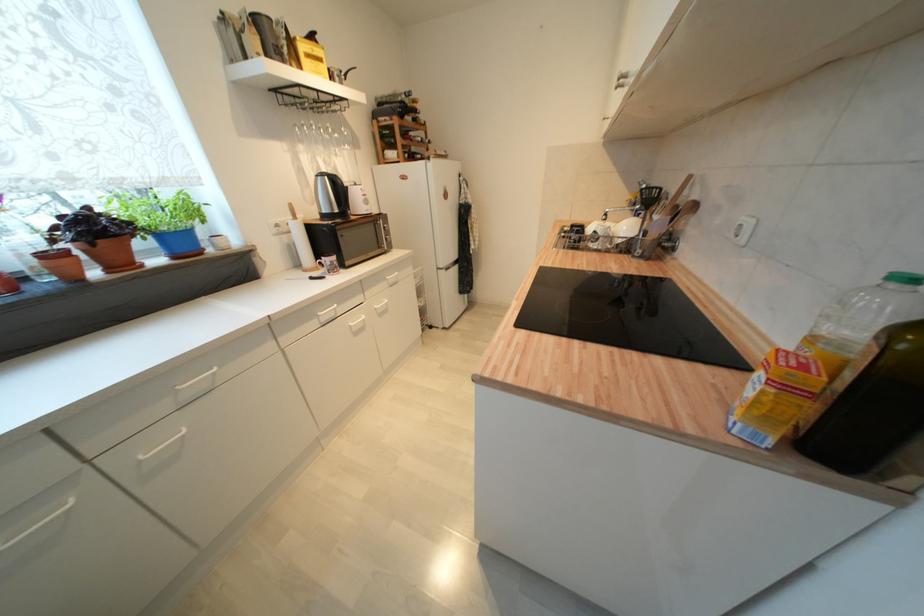
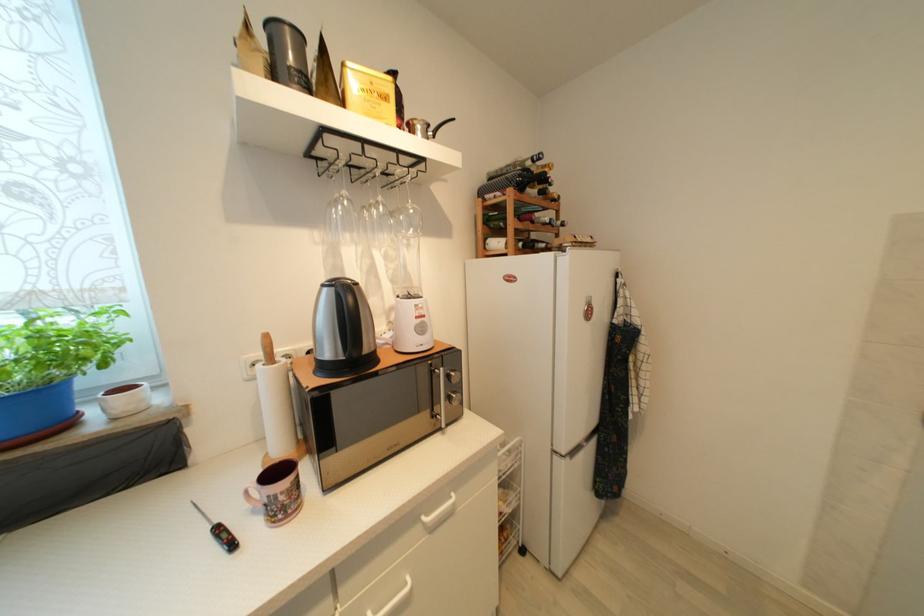
Find the pixel in the second image that matches point (399, 99) in the first image.

(518, 166)